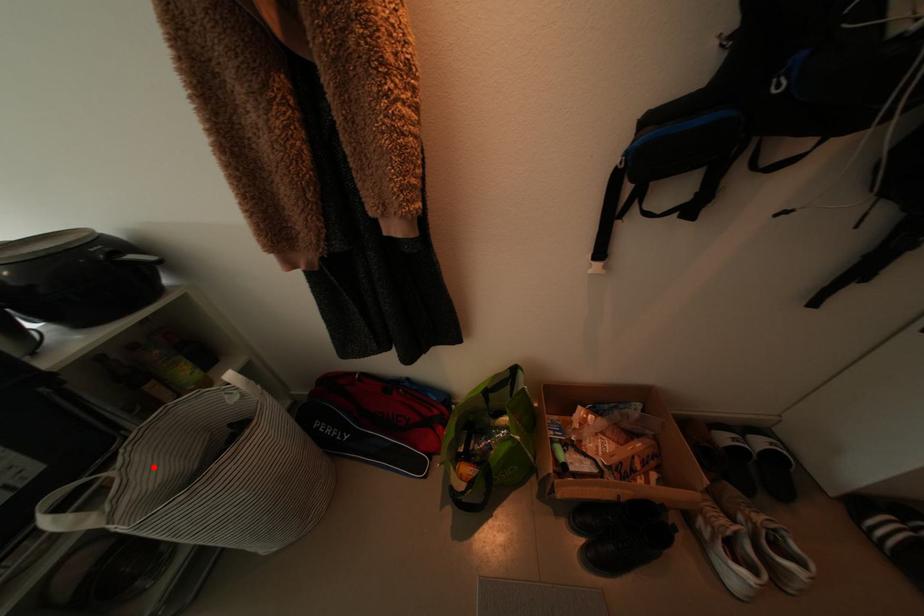
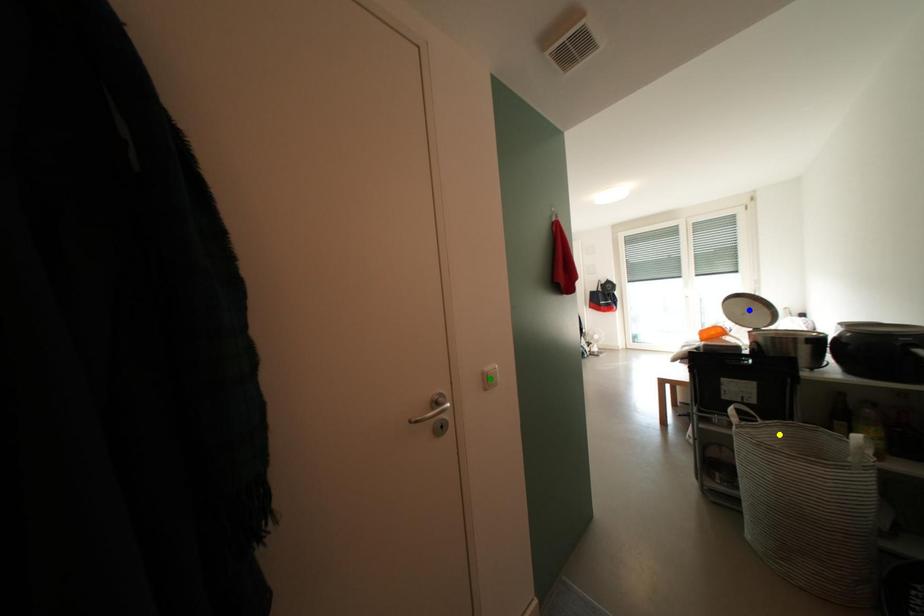
Question: I am providing you with two images of the same scene from different viewpoints. A red point is marked on the first image. You are given multiple points on the second image. Which point in image 2 is actually the same real-world point as the red point in image 1?

Choices:
 (A) blue point
 (B) green point
 (C) yellow point

Answer: (C)